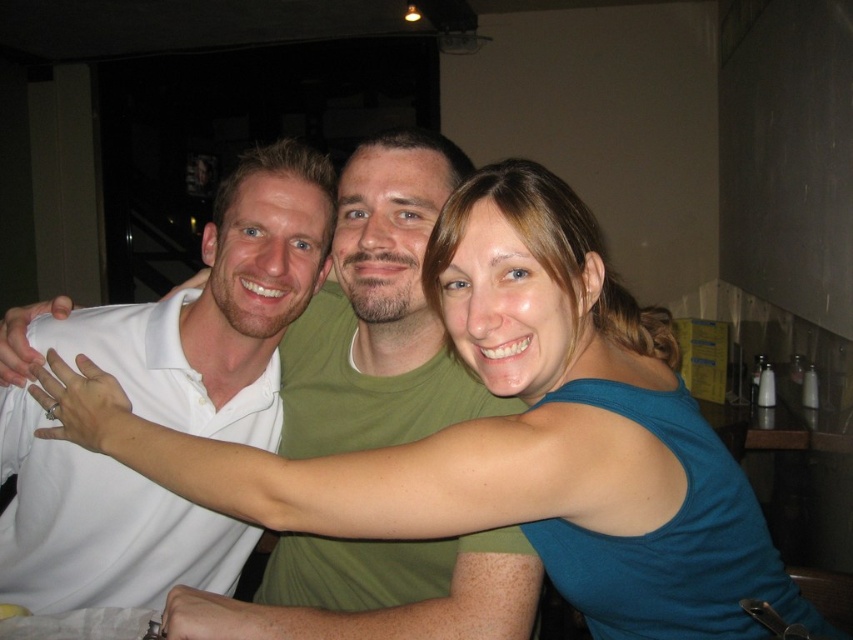
Is point (223, 476) positioned before point (54, 541)?

Yes, it is.

Is point (474, 429) more distant than point (221, 314)?

No.

Where is `blue fabric at center`? This screenshot has width=853, height=640. blue fabric at center is located at coordinates (492, 419).